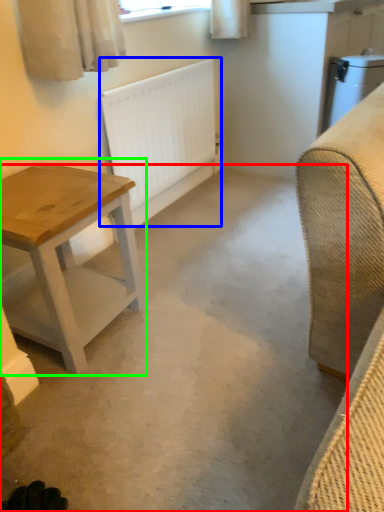
Question: Which object is positioned farthest from concrete (highlighted by a red box)? Select from radiator (highlighted by a blue box) and table (highlighted by a green box).

Choices:
 (A) radiator
 (B) table

Answer: (A)